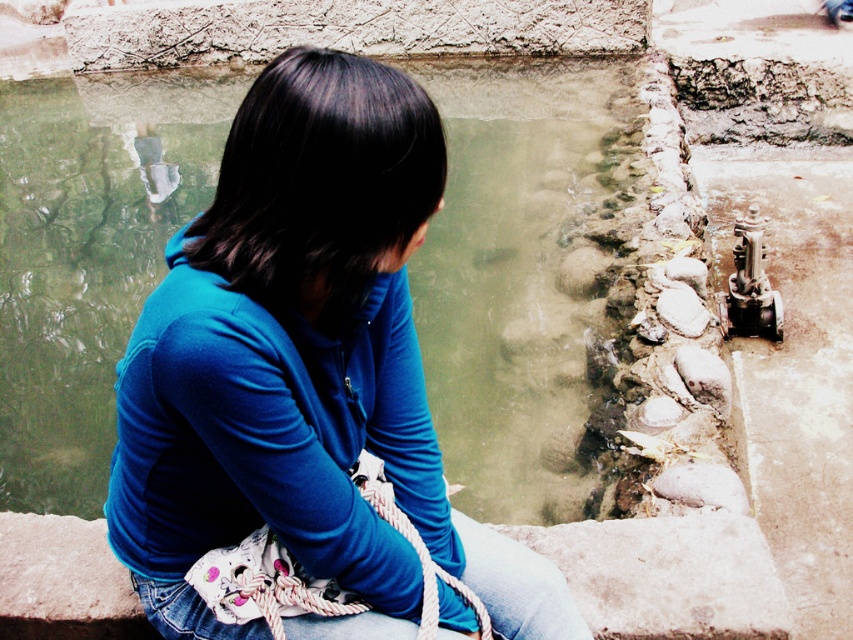
Between blue fabric girl at center and denim at left, which one appears on the left side from the viewer's perspective?

Positioned to the left is blue fabric girl at center.

Does blue fabric girl at center appear over denim at left?

Indeed, blue fabric girl at center is positioned over denim at left.

At what (x,y) coordinates should I click in order to perform the action: click on blue fabric girl at center. Please return your answer as a coordinate pair (x, y). Looking at the image, I should click on (303, 369).

The height and width of the screenshot is (640, 853). Identify the location of blue fabric girl at center. (303, 369).